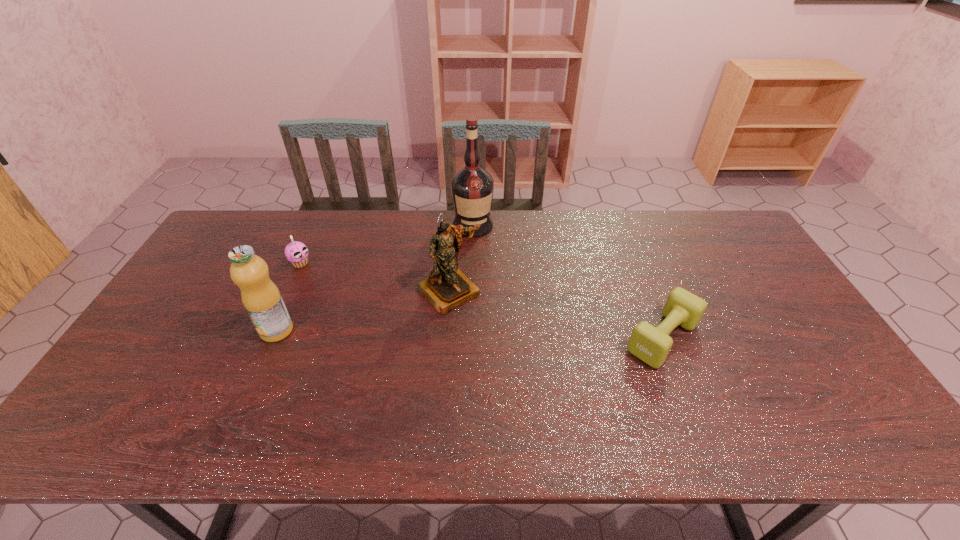
Find the location of a particular element. The image size is (960, 540). free space on the desktop that is between the fruit juice and the shortest object and is positioned on the surface of the tallest object is located at coordinates (490, 334).

The width and height of the screenshot is (960, 540). I want to click on vacant space on the desktop that is between the fruit juice and the rightmost object and is positioned on the face of the cupcake, so click(x=428, y=333).

Identify the location of vacant space on the desktop that is between the fruit juice and the dumbbell and is positioned on the front-facing side of the figurine. This screenshot has height=540, width=960. (489, 334).